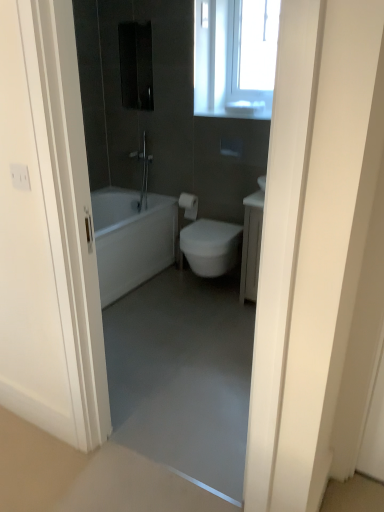
Where is `free spot above white glossy bidet at center (from a real-world perspective)`? free spot above white glossy bidet at center (from a real-world perspective) is located at coordinates (209, 229).